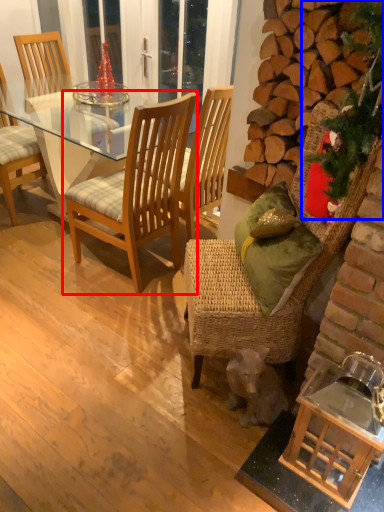
Question: Which of the following is the farthest to the observer, chair (highlighted by a red box) or christmas decoration (highlighted by a blue box)?

Choices:
 (A) chair
 (B) christmas decoration

Answer: (A)